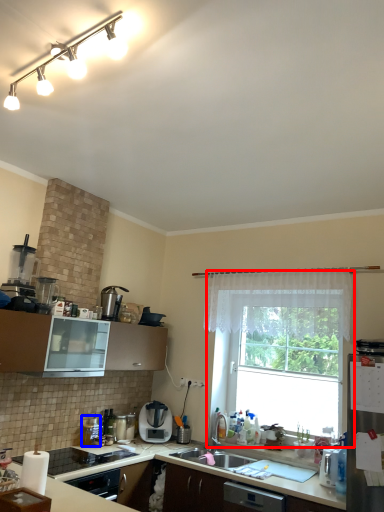
Question: Among these objects, which one is farthest to the camera, window (highlighted by a red box) or appliance (highlighted by a blue box)?

Choices:
 (A) window
 (B) appliance

Answer: (B)